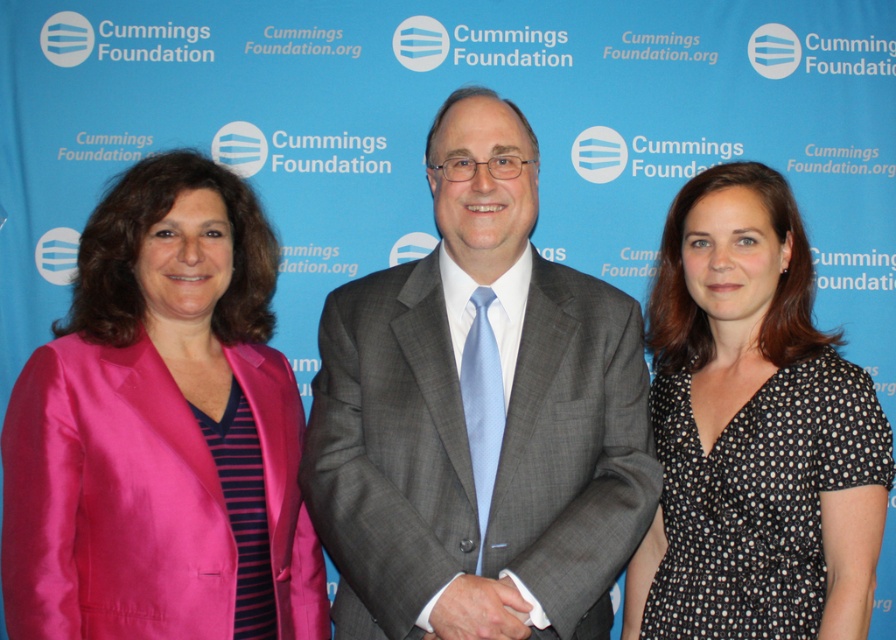
Does gray suit at center have a larger size compared to satin pink blazer at left?

Yes, gray suit at center is bigger than satin pink blazer at left.

What do you see at coordinates (478, 406) in the screenshot? I see `gray suit at center` at bounding box center [478, 406].

Between point (490, 337) and point (243, 356), which one is positioned behind?

The point (243, 356) is more distant.

You are a GUI agent. You are given a task and a screenshot of the screen. Output one action in this format:
    pyautogui.click(x=<x>, y=<y>)
    Task: Click on the gray suit at center
    This screenshot has width=896, height=640.
    Given the screenshot: What is the action you would take?
    pyautogui.click(x=478, y=406)

Does satin pink blazer at left have a lesser height compared to white satin hand at center?

Incorrect, satin pink blazer at left's height does not fall short of white satin hand at center's.

Does satin pink blazer at left appear under white satin hand at center?

Incorrect, satin pink blazer at left is not positioned below white satin hand at center.

Describe the element at coordinates (161, 429) in the screenshot. I see `satin pink blazer at left` at that location.

Where is `satin pink blazer at left`? The width and height of the screenshot is (896, 640). satin pink blazer at left is located at coordinates (161, 429).

Between satin pink blazer at left and black dotted dress at center, which one is positioned higher?

black dotted dress at center

Where is `satin pink blazer at left`? The width and height of the screenshot is (896, 640). satin pink blazer at left is located at coordinates (161, 429).

The image size is (896, 640). Find the location of `satin pink blazer at left`. satin pink blazer at left is located at coordinates (161, 429).